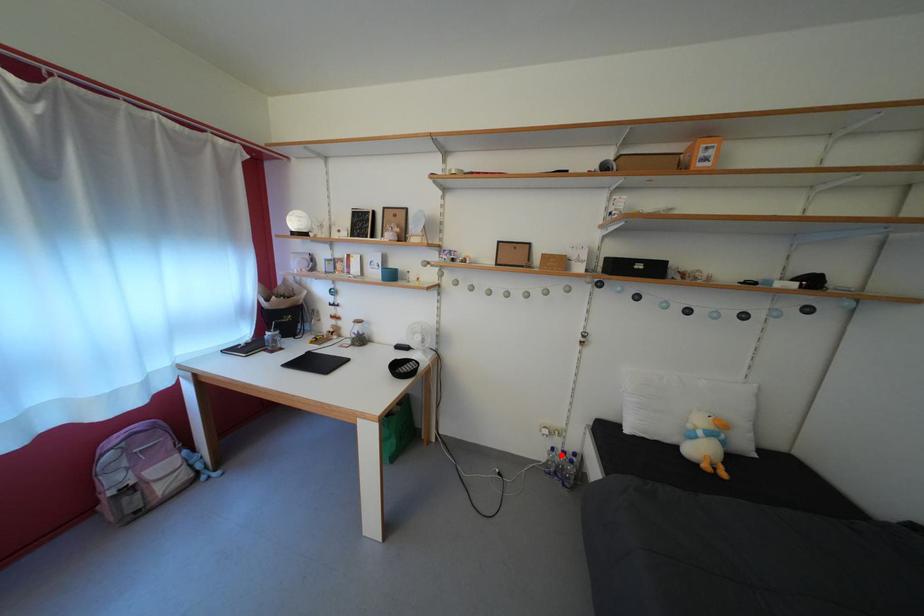
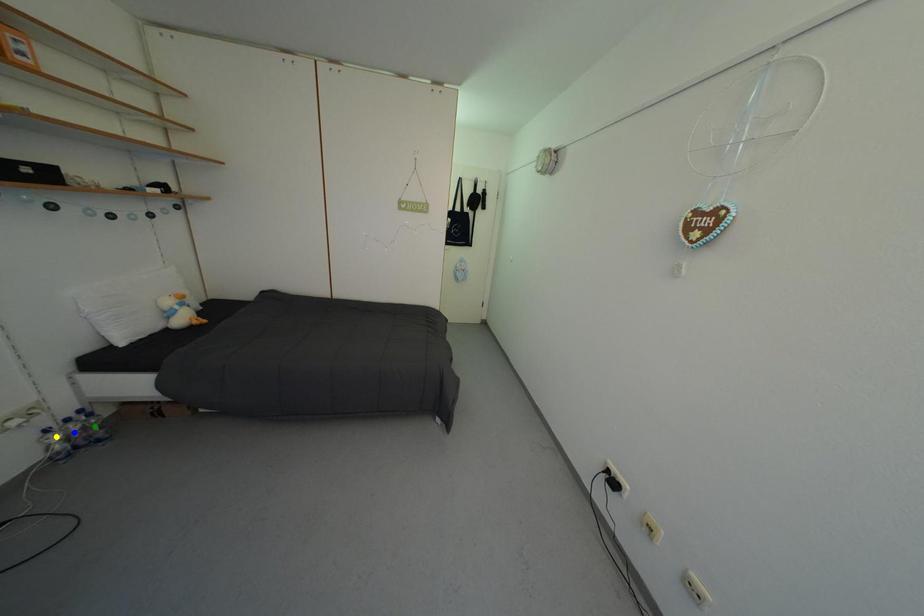
Question: I am providing you with two images of the same scene from different viewpoints. A red point is marked on the first image. You are given multiple points on the second image. Which point in image 2 is actually the same real-world point as the red point in image 1?

Choices:
 (A) yellow point
 (B) green point
 (C) blue point

Answer: (A)